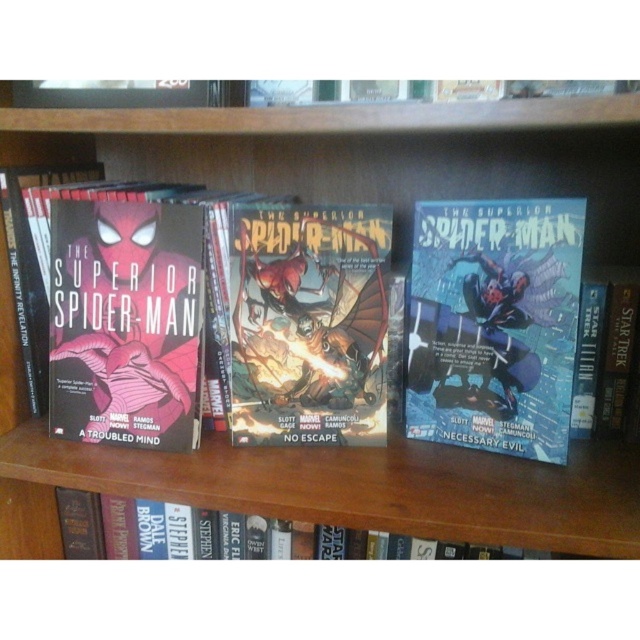
Question: Which object is positioned farthest from the matte black comic book at left?

Choices:
 (A) hardcover book at lower center
 (B) matte black comic book at center
 (C) shiny metallic comic book at center

Answer: (B)

Question: Is matte black comic book at center to the right of shiny metallic comic book at center from the viewer's perspective?

Choices:
 (A) yes
 (B) no

Answer: (A)

Question: Can you confirm if matte black comic book at center is positioned above matte black comic book at left?

Choices:
 (A) no
 (B) yes

Answer: (A)

Question: Does shiny metallic comic book at center have a lesser width compared to matte black comic book at left?

Choices:
 (A) yes
 (B) no

Answer: (B)

Question: Which point is farther to the camera?

Choices:
 (A) (497, 259)
 (B) (324, 259)

Answer: (B)

Question: Which of the following is the closest to the observer?

Choices:
 (A) matte black comic book at left
 (B) shiny metallic comic book at center
 (C) hardcover book at lower center

Answer: (B)